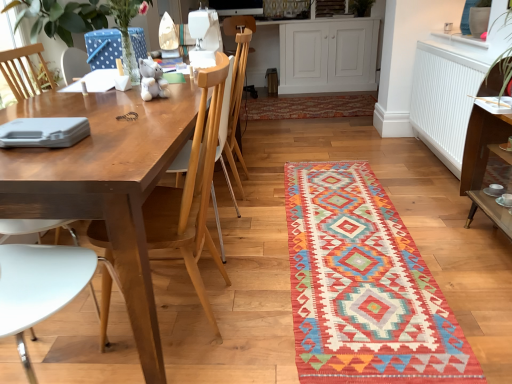
Question: Can you confirm if wooden chair at center is thinner than multicolored woven mat at center?

Choices:
 (A) yes
 (B) no

Answer: (A)

Question: Considering the relative sizes of wooden chair at center and multicolored woven mat at center in the image provided, is wooden chair at center wider than multicolored woven mat at center?

Choices:
 (A) yes
 (B) no

Answer: (B)

Question: Is wooden chair at center looking in the opposite direction of multicolored woven mat at center?

Choices:
 (A) no
 (B) yes

Answer: (A)

Question: Is wooden chair at center next to multicolored woven mat at center?

Choices:
 (A) no
 (B) yes

Answer: (A)

Question: From a real-world perspective, is wooden chair at center located higher than multicolored woven mat at center?

Choices:
 (A) no
 (B) yes

Answer: (B)

Question: Considering the positions of point (181, 155) and point (377, 29), is point (181, 155) closer or farther from the camera than point (377, 29)?

Choices:
 (A) closer
 (B) farther

Answer: (A)

Question: From a real-world perspective, relative to white wood cabinet at upper center, is wooden chair at center vertically above or below?

Choices:
 (A) above
 (B) below

Answer: (A)

Question: Considering their positions, is wooden chair at center located in front of or behind white wood cabinet at upper center?

Choices:
 (A) front
 (B) behind

Answer: (A)

Question: Considering the positions of wooden chair at center and white wood cabinet at upper center in the image, is wooden chair at center bigger or smaller than white wood cabinet at upper center?

Choices:
 (A) big
 (B) small

Answer: (B)

Question: From the image's perspective, is multicolored woven mat at center located above or below wooden chair at center?

Choices:
 (A) above
 (B) below

Answer: (B)

Question: Is multicolored woven mat at center inside or outside of wooden chair at center?

Choices:
 (A) outside
 (B) inside

Answer: (A)

Question: Looking at their shapes, would you say multicolored woven mat at center is wider or thinner than wooden chair at center?

Choices:
 (A) wide
 (B) thin

Answer: (A)

Question: Is multicolored woven mat at center taller or shorter than wooden chair at center?

Choices:
 (A) tall
 (B) short

Answer: (B)

Question: Is point [x=229, y=132] closer or farther from the camera than point [x=295, y=233]?

Choices:
 (A) farther
 (B) closer

Answer: (A)

Question: Is wooden chair at center in front of or behind multicolored woven mat at center in the image?

Choices:
 (A) front
 (B) behind

Answer: (B)